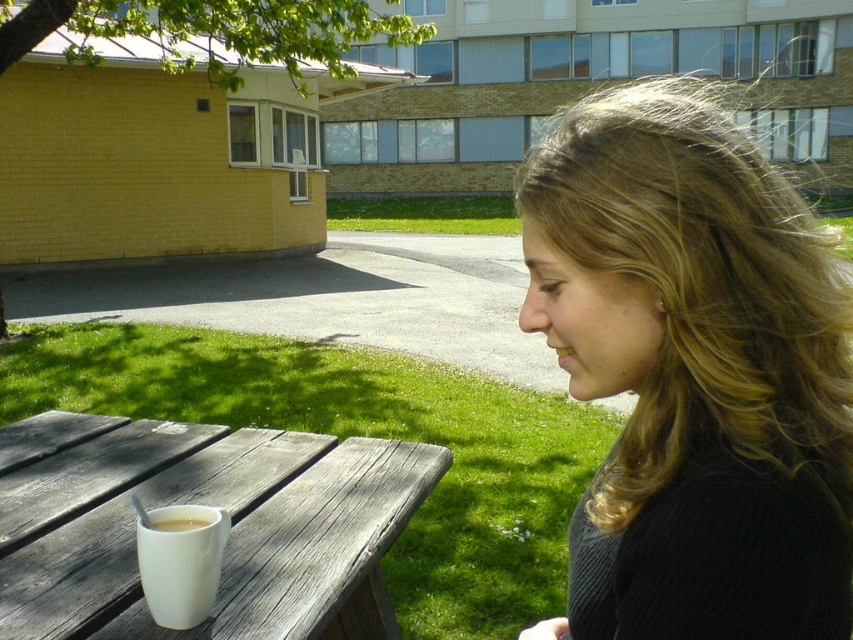
Does point (778, 436) lie behind point (192, 524)?

That is False.

Who is more forward, (636, 342) or (177, 524)?

Point (636, 342)

This screenshot has width=853, height=640. Identify the location of dark brown hair at right. (693, 372).

Locate an element on the screen. The image size is (853, 640). white ceramic mug at lower left is located at coordinates (178, 561).

Consider the image. Which is above, white ceramic mug at lower left or white matte mug at table left?

white matte mug at table left is above.

Who is more distant from viewer, (160, 545) or (193, 528)?

The point (193, 528) is behind.

Locate an element on the screen. white ceramic mug at lower left is located at coordinates (178, 561).

Is dark brown hair at right taller than white wood table at lower left?

Indeed, dark brown hair at right has a greater height compared to white wood table at lower left.

Is dark brown hair at right bigger than white wood table at lower left?

No.

Identify the location of dark brown hair at right. This screenshot has width=853, height=640. (693, 372).